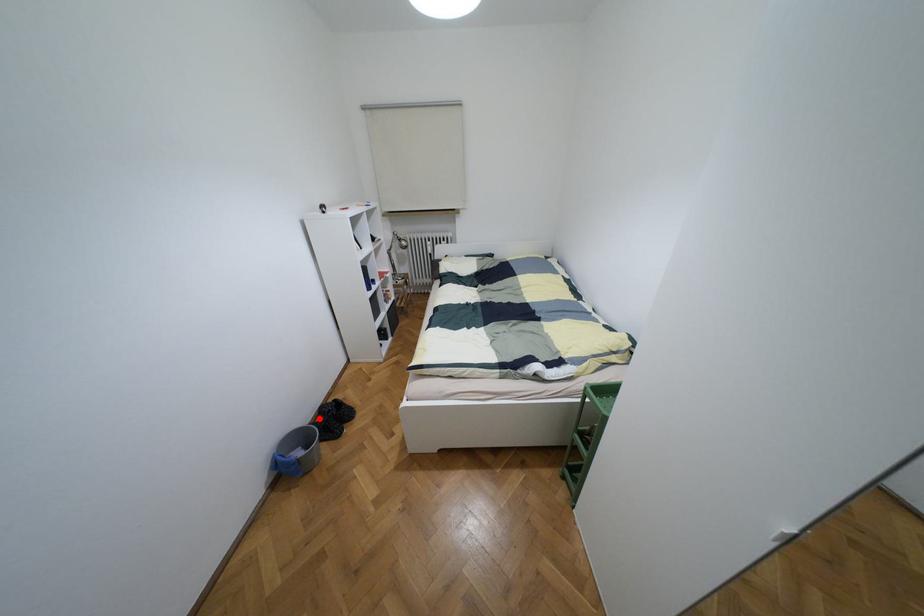
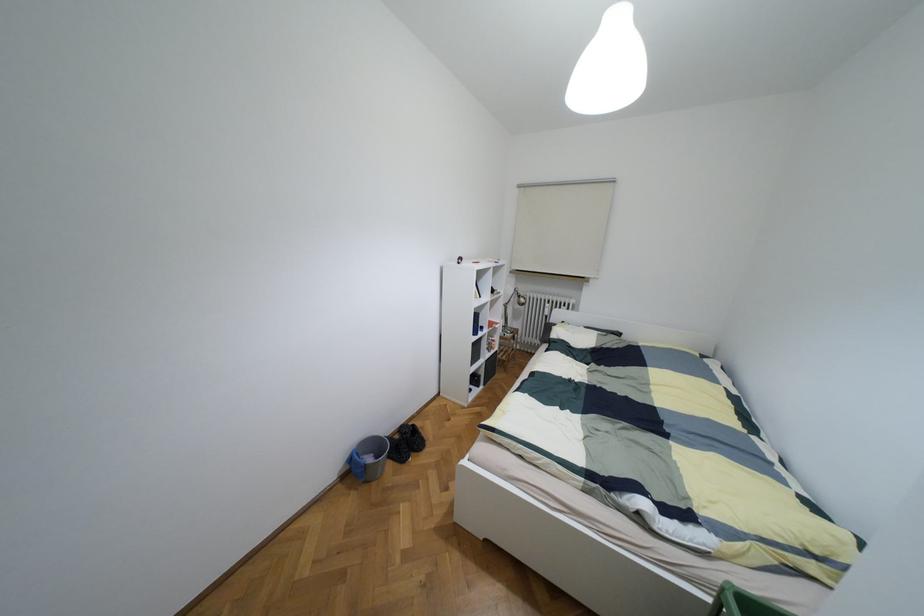
Question: I am providing you with two images of the same scene from different viewpoints. A red point is shown in image1. For the corresponding object point in image2, is it positioned nearer or farther from the camera?

Choices:
 (A) Nearer
 (B) Farther

Answer: (B)